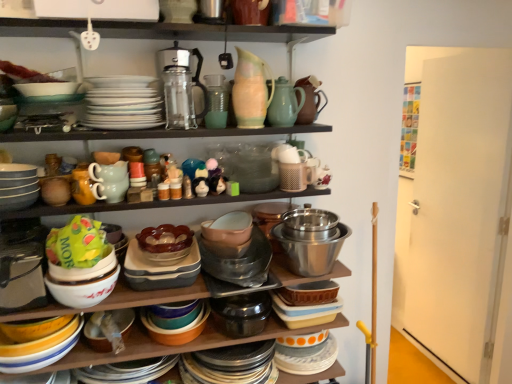
Question: Relative to white glazed platter at center, which is the 1th platter from bottom to top, is matte plastic containers at center in front or behind?

Choices:
 (A) front
 (B) behind

Answer: (B)

Question: From the image's perspective, is matte plastic containers at center located above or below white glazed platter at center, which is the 2th platter from top to bottom?

Choices:
 (A) above
 (B) below

Answer: (A)

Question: Which object is positioned farthest from the matte ceramic vase at upper center, the 1th tableware from the top?

Choices:
 (A) white glazed platter at center, which is the 2th platter from top to bottom
 (B) green glass vase at upper center, the second tableware viewed from the top
 (C) shiny metallic bowls at center, which ranks as the first bowl in right-to-left order
 (D) translucent glass cups at upper center
 (E) matte ceramic teapot at upper center, which appears as the second tea pot when viewed from the left

Answer: (A)

Question: Considering the real-world distances, which object is farthest from the matte green teapot at center-left, which ranks as the 3th tableware in top-to-bottom order?

Choices:
 (A) matte plastic containers at center
 (B) brown matte teapot at upper center, the first tea pot positioned from the right
 (C) green matte bag at center
 (D) matte ceramic vase at upper center, the 1th tableware from the top
 (E) shiny metallic bowls at center, marked as the 3th bowl in a left-to-right arrangement

Answer: (B)